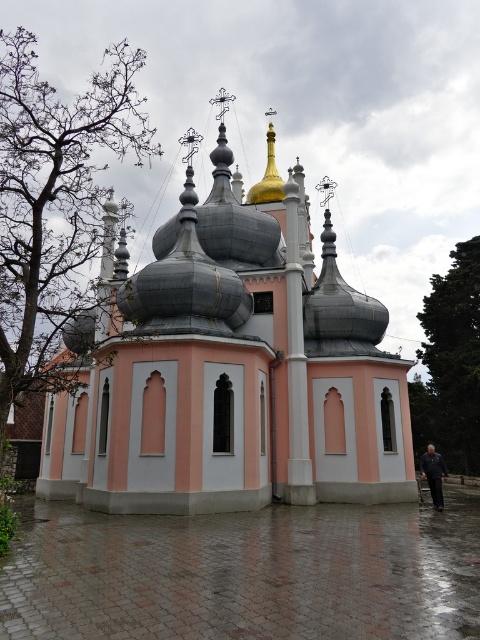
Does pink matte church at center have a lesser height compared to gold polished dome at center?

No.

Is point (263, 221) in front of point (267, 125)?

Yes.

Where is `pink matte church at center`? The height and width of the screenshot is (640, 480). pink matte church at center is located at coordinates (232, 369).

Can you confirm if gold polished dome at center is taller than dark blue fabric at lower right?

Yes.

Can you confirm if gold polished dome at center is wider than dark blue fabric at lower right?

No.

Is point (261, 198) closer to camera compared to point (433, 448)?

Yes, point (261, 198) is in front of point (433, 448).

Where is `gold polished dome at center`? The height and width of the screenshot is (640, 480). gold polished dome at center is located at coordinates (267, 177).

Which is in front, point (298, 237) or point (422, 468)?

Point (422, 468) is more forward.

Between pink matte church at center and dark blue fabric at lower right, which one is positioned lower?

Positioned lower is dark blue fabric at lower right.

Which is behind, point (178, 504) or point (422, 476)?

The point (422, 476) is behind.

Where is `pink matte church at center`? The height and width of the screenshot is (640, 480). pink matte church at center is located at coordinates (232, 369).